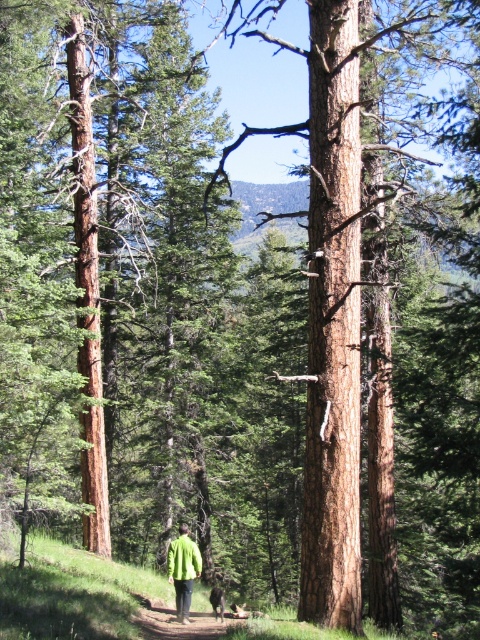
Is point (188, 538) in front of point (215, 609)?

Yes, point (188, 538) is in front of point (215, 609).

Does green fuzzy jacket at lower center have a greater height compared to brown fur dog at center?

Incorrect, green fuzzy jacket at lower center's height is not larger of brown fur dog at center's.

Between point (180, 541) and point (217, 609), which one is positioned in front?

Point (180, 541)

Where is `green fuzzy jacket at lower center`? green fuzzy jacket at lower center is located at coordinates (182, 557).

Can you confirm if green matte jacket at center is positioned to the left of brown fur dog at center?

Yes, green matte jacket at center is to the left of brown fur dog at center.

Between green matte jacket at center and brown fur dog at center, which one is positioned lower?

brown fur dog at center

Where is `green matte jacket at center`? The width and height of the screenshot is (480, 640). green matte jacket at center is located at coordinates (182, 570).

Locate an element on the screen. This screenshot has height=640, width=480. green matte jacket at center is located at coordinates (182, 570).

Consider the image. Is green matte jacket at center above green fuzzy jacket at lower center?

No, green matte jacket at center is not above green fuzzy jacket at lower center.

This screenshot has height=640, width=480. What do you see at coordinates (182, 570) in the screenshot? I see `green matte jacket at center` at bounding box center [182, 570].

Which is in front, point (191, 586) or point (168, 545)?

Point (191, 586) is in front.

You are a GUI agent. You are given a task and a screenshot of the screen. Output one action in this format:
    pyautogui.click(x=<x>, y=<y>)
    Task: Click on the green matte jacket at center
    
    Given the screenshot: What is the action you would take?
    pyautogui.click(x=182, y=570)